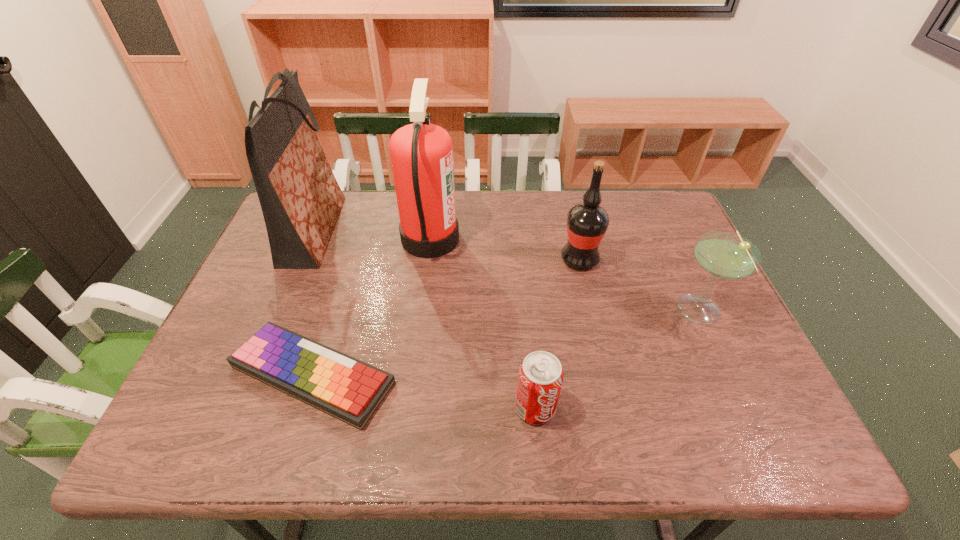
Find the location of a particular element. The width and height of the screenshot is (960, 540). computer keyboard that is at the left edge is located at coordinates (350, 390).

Where is `object at the right edge`? object at the right edge is located at coordinates (725, 255).

This screenshot has height=540, width=960. I want to click on object at the far left corner, so click(x=300, y=198).

Locate an element on the screen. object situated at the near left corner is located at coordinates (350, 390).

Image resolution: width=960 pixels, height=540 pixels. In the image, there is a desktop. Identify the location of free space at the far edge. pos(473,230).

The height and width of the screenshot is (540, 960). In the image, there is a desktop. Identify the location of free region at the near edge. 261,426.

The width and height of the screenshot is (960, 540). I want to click on vacant space at the left edge, so click(x=252, y=271).

Find the location of a particular element. This screenshot has height=540, width=960. vacant space at the right edge is located at coordinates (710, 374).

This screenshot has height=540, width=960. In the image, there is a desktop. Find the location of `vacant space at the near left corner`. vacant space at the near left corner is located at coordinates (x=232, y=426).

I want to click on vacant region at the far right corner of the desktop, so (643, 222).